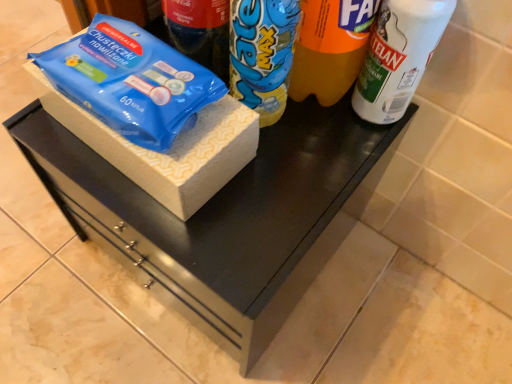
Question: Is white matte spray can at upper right at the right side of blue plastic wipes at left?

Choices:
 (A) no
 (B) yes

Answer: (B)

Question: Is white matte spray can at upper right further to camera compared to blue plastic wipes at left?

Choices:
 (A) yes
 (B) no

Answer: (B)

Question: Is white matte spray can at upper right surrounding blue plastic wipes at left?

Choices:
 (A) yes
 (B) no

Answer: (B)

Question: Is white matte spray can at upper right closer to the viewer compared to blue plastic wipes at left?

Choices:
 (A) yes
 (B) no

Answer: (A)

Question: Considering the relative sizes of white matte spray can at upper right and blue plastic wipes at left in the image provided, is white matte spray can at upper right thinner than blue plastic wipes at left?

Choices:
 (A) no
 (B) yes

Answer: (B)

Question: Is white matte spray can at upper right aimed at blue plastic wipes at left?

Choices:
 (A) no
 (B) yes

Answer: (A)

Question: Considering the relative positions of yellow matte drinking straw at center and blue plastic bottle at center in the image provided, is yellow matte drinking straw at center to the left of blue plastic bottle at center from the viewer's perspective?

Choices:
 (A) yes
 (B) no

Answer: (B)

Question: From a real-world perspective, does yellow matte drinking straw at center stand above blue plastic bottle at center?

Choices:
 (A) no
 (B) yes

Answer: (B)

Question: Considering the relative sizes of yellow matte drinking straw at center and blue plastic bottle at center in the image provided, is yellow matte drinking straw at center shorter than blue plastic bottle at center?

Choices:
 (A) yes
 (B) no

Answer: (B)

Question: Can you confirm if yellow matte drinking straw at center is taller than blue plastic bottle at center?

Choices:
 (A) no
 (B) yes

Answer: (B)

Question: Considering the relative positions of yellow matte drinking straw at center and blue plastic bottle at center in the image provided, is yellow matte drinking straw at center to the right of blue plastic bottle at center from the viewer's perspective?

Choices:
 (A) no
 (B) yes

Answer: (B)

Question: Is the depth of yellow matte drinking straw at center less than that of blue plastic bottle at center?

Choices:
 (A) yes
 (B) no

Answer: (A)

Question: Is white matte spray can at upper right bigger than wooden box at center?

Choices:
 (A) no
 (B) yes

Answer: (A)